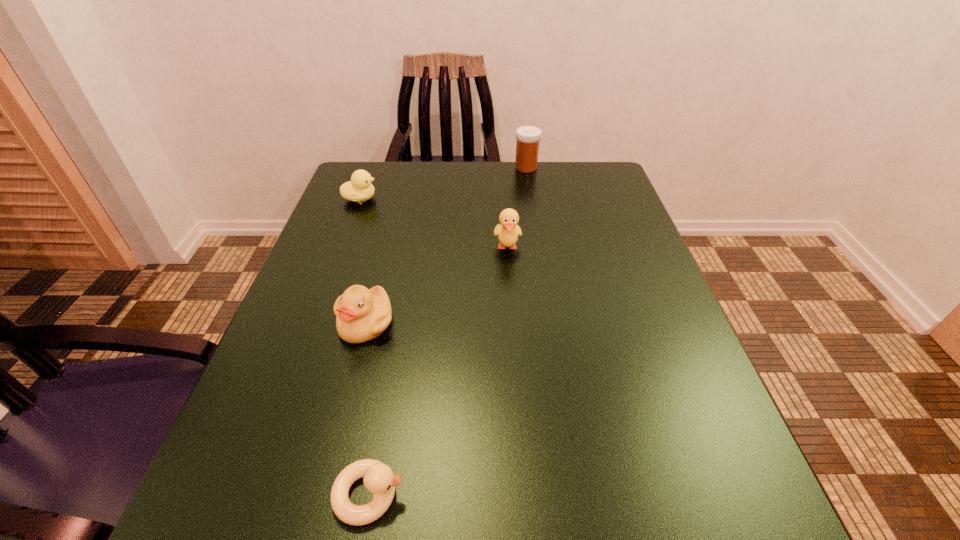
The width and height of the screenshot is (960, 540). In order to click on vacant space located 0.300m on the front-facing side of the third nearest duckling in this screenshot , I will do 517,380.

You are a GUI agent. You are given a task and a screenshot of the screen. Output one action in this format:
    pyautogui.click(x=<x>, y=<y>)
    Task: Click on the vacant position located 0.100m on the front-facing side of the third farthest duckling
    
    Given the screenshot: What is the action you would take?
    pyautogui.click(x=347, y=396)

Where is `vacant space located 0.300m at the beak of the third tallest duckling`? vacant space located 0.300m at the beak of the third tallest duckling is located at coordinates (497, 199).

Where is `free spot located at the beak of the nearest object`? The height and width of the screenshot is (540, 960). free spot located at the beak of the nearest object is located at coordinates (459, 494).

Where is `medicine present at the far edge`? This screenshot has height=540, width=960. medicine present at the far edge is located at coordinates (527, 146).

The height and width of the screenshot is (540, 960). I want to click on duckling situated at the far edge, so click(x=359, y=189).

Locate an element on the screen. This screenshot has height=540, width=960. object that is at the near edge is located at coordinates (379, 479).

Where is `object present at the far left corner`? Image resolution: width=960 pixels, height=540 pixels. object present at the far left corner is located at coordinates (359, 189).

In the image, there is a desktop. Where is `vacant space at the far edge`? The image size is (960, 540). vacant space at the far edge is located at coordinates (533, 183).

Identify the location of vacant space at the left edge of the desktop. This screenshot has height=540, width=960. (336, 380).